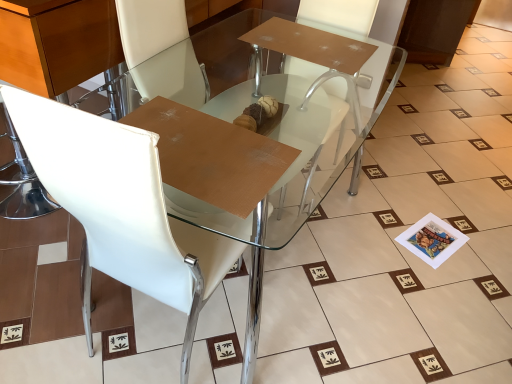
Question: Is transparent glass table at center in front of white leather chair at upper left?

Choices:
 (A) no
 (B) yes

Answer: (A)

Question: Considering the relative sizes of transparent glass table at center and white leather chair at upper left in the image provided, is transparent glass table at center bigger than white leather chair at upper left?

Choices:
 (A) no
 (B) yes

Answer: (B)

Question: Is transparent glass table at center turned away from white leather chair at upper left?

Choices:
 (A) yes
 (B) no

Answer: (B)

Question: Is transparent glass table at center touching white leather chair at upper left?

Choices:
 (A) yes
 (B) no

Answer: (B)

Question: Considering the relative sizes of transparent glass table at center and white leather chair at upper left in the image provided, is transparent glass table at center shorter than white leather chair at upper left?

Choices:
 (A) yes
 (B) no

Answer: (A)

Question: Looking at the image, does white leather armchair at center seem bigger or smaller compared to white leather chair at upper left?

Choices:
 (A) small
 (B) big

Answer: (A)

Question: In terms of width, does white leather armchair at center look wider or thinner when compared to white leather chair at upper left?

Choices:
 (A) thin
 (B) wide

Answer: (A)

Question: Is white leather armchair at center in front of or behind white leather chair at upper left in the image?

Choices:
 (A) behind
 (B) front

Answer: (A)

Question: Based on their positions, is white leather armchair at center located to the left or right of white leather chair at upper left?

Choices:
 (A) right
 (B) left

Answer: (A)

Question: From a real-world perspective, is white leather chair at upper left above or below transparent glass table at center?

Choices:
 (A) below
 (B) above

Answer: (B)

Question: From the image's perspective, is white leather chair at upper left located above or below transparent glass table at center?

Choices:
 (A) below
 (B) above

Answer: (A)

Question: Considering the positions of point (159, 249) and point (333, 44), is point (159, 249) closer or farther from the camera than point (333, 44)?

Choices:
 (A) farther
 (B) closer

Answer: (B)

Question: Visually, is white leather chair at upper left positioned to the left or to the right of transparent glass table at center?

Choices:
 (A) left
 (B) right

Answer: (A)

Question: Looking at the image, does white leather chair at upper left seem bigger or smaller compared to white leather armchair at center?

Choices:
 (A) small
 (B) big

Answer: (B)

Question: Relative to white leather armchair at center, is white leather chair at upper left in front or behind?

Choices:
 (A) behind
 (B) front

Answer: (B)